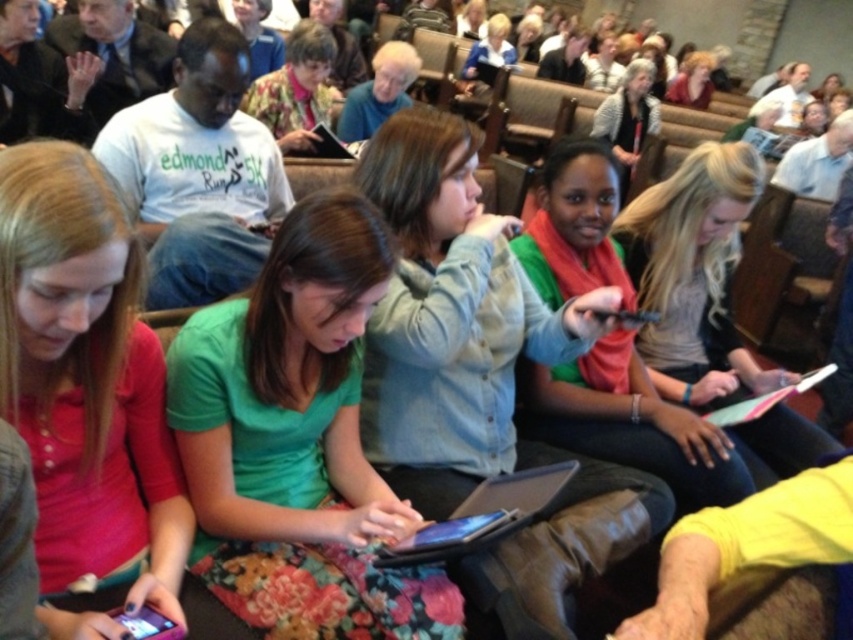
Question: Which point is farther to the camera?

Choices:
 (A) (653, 80)
 (B) (410, 68)

Answer: (A)

Question: Among these points, which one is nearest to the camera?

Choices:
 (A) (651, 472)
 (B) (573, 52)
 (C) (288, 262)
 (D) (701, 100)

Answer: (C)

Question: Does white matte t-shirt at center appear under matte black jacket at upper center?

Choices:
 (A) yes
 (B) no

Answer: (A)

Question: Can you confirm if white hair at upper center is bigger than matte black jacket at upper right?

Choices:
 (A) yes
 (B) no

Answer: (B)

Question: Which is farther from the white t-shirt at upper right?

Choices:
 (A) white hair at upper center
 (B) matte black jacket at upper center
 (C) green fabric scarf at center

Answer: (C)

Question: Is the position of matte gray sweater at center more distant than that of matte black jacket at upper right?

Choices:
 (A) no
 (B) yes

Answer: (A)